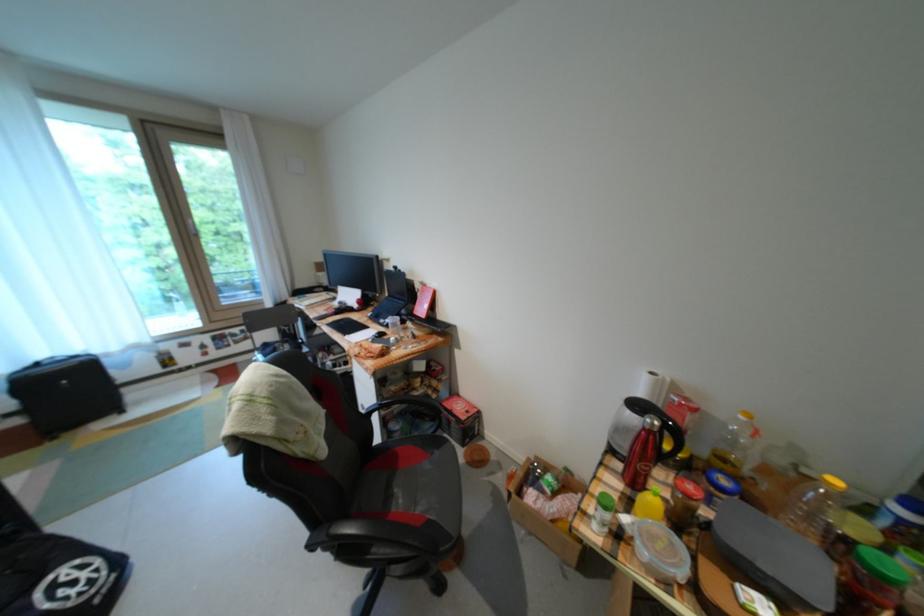
What do you see at coordinates (879, 575) in the screenshot?
I see `a jar with green lid` at bounding box center [879, 575].